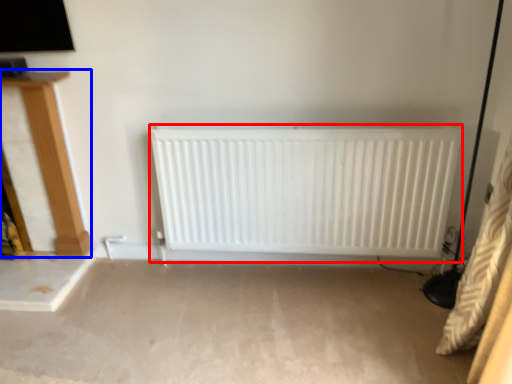
Question: Which of the following is the farthest to the observer, radiator (highlighted by a red box) or furniture (highlighted by a blue box)?

Choices:
 (A) radiator
 (B) furniture

Answer: (B)